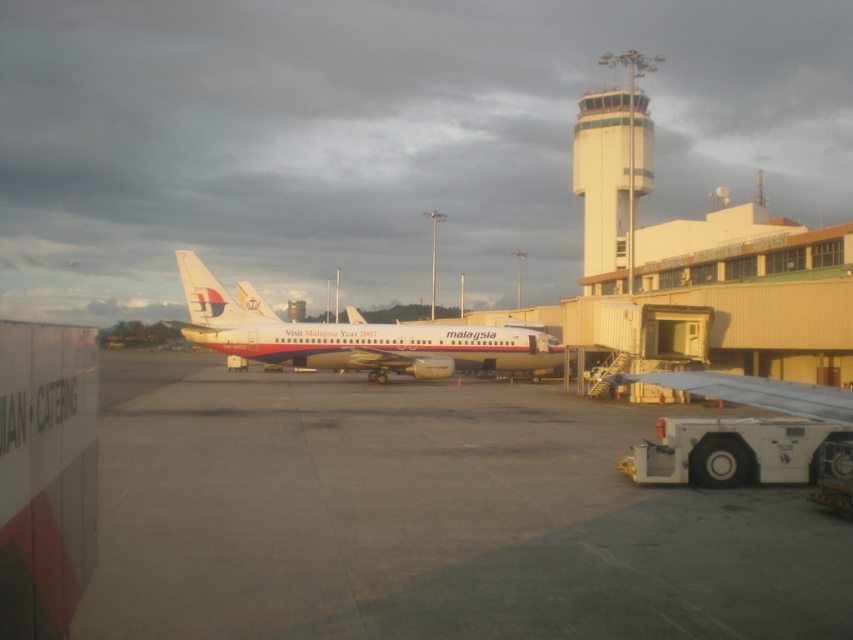
You are a pilot who just landed your plane and needs to taxi to the gate. You see the white glossy airplane at center and the white concrete control tower at upper center. Which one is narrower from your perspective?

The white glossy airplane at center is thinner than the white concrete control tower at upper center, so the airplane is narrower.

You are a maintenance worker needing to reach the white glossy airplane at center from the white concrete control tower at upper center. Given that your equipment can only travel up to 20 meters, will you be able to reach it without needing additional transport?

The distance between the white glossy airplane at center and the white concrete control tower at upper center is 20.17 meters. Since your equipment can only travel up to 20 meters, you will need additional transport to cover the remaining 0.17 meters.

You are a pilot who just landed your plane at the airport. You need to determine which structure takes up more area in the image between the gray concrete tarmac at center and the white concrete control tower at upper center. Which one is larger?

The white concrete control tower at upper center occupies more space than the gray concrete tarmac at center in the image.